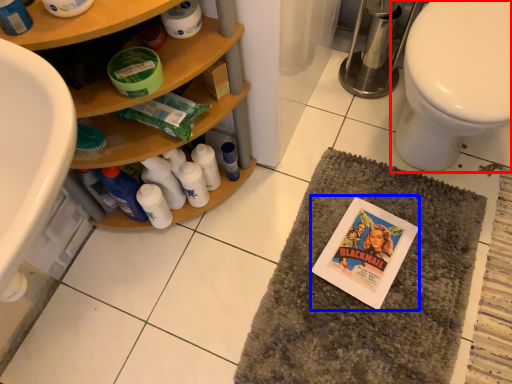
Question: Which object is closer to the camera taking this photo, toilet (highlighted by a red box) or comic book (highlighted by a blue box)?

Choices:
 (A) toilet
 (B) comic book

Answer: (A)